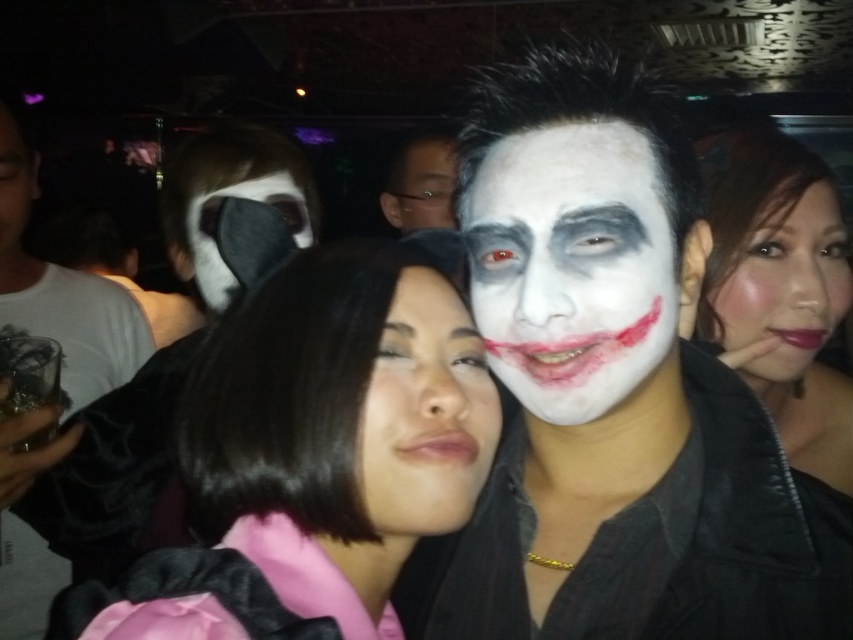
You are a photographer at a party who needs to capture a closeup shot of both the matte white face at center and the matte black mask at center in the same frame. Based on their current positions, can you fit both into your camera viewfinder which has a maximum width of 17 inches?

The distance between the matte white face at center and the matte black mask at center is 16.95 inches, which is just under the camera viewfinder maximum width of 17 inches. Therefore, both can be captured in the same frame.

You are a photographer at the party and want to take a photo of both the matte white face at center and the matte black mask at center. Which one should you focus on first if you want to capture them in the order they appear from left to right?

The matte black mask at center should be focused on first since it is on the left side of the matte white face at center, which is on the right.

You are a photographer at the party and want to capture a closeup shot of both the matte black jacket at right and the matte black face at right in the same frame. Given that your camera has a minimum focus distance of 1 inch, will you be able to take the photo without moving the subjects?

The matte black jacket at right and the matte black face at right are 0.99 inches apart from each other, which is less than the camera minimum focus distance of 1 inch. Therefore, you can take the photo without moving the subjects.